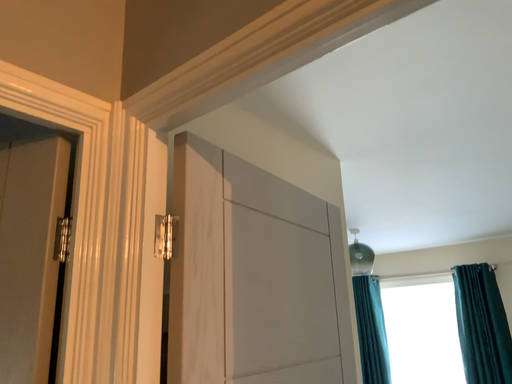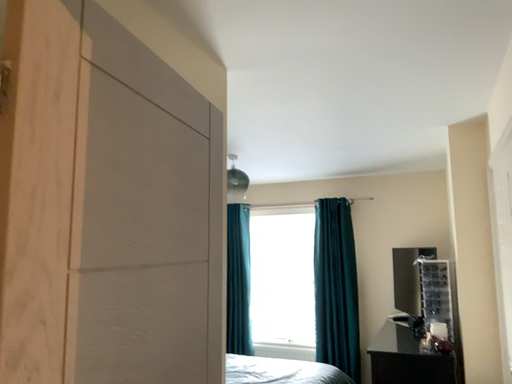
Question: How did the camera likely rotate when shooting the video?

Choices:
 (A) rotated upward
 (B) rotated downward

Answer: (B)